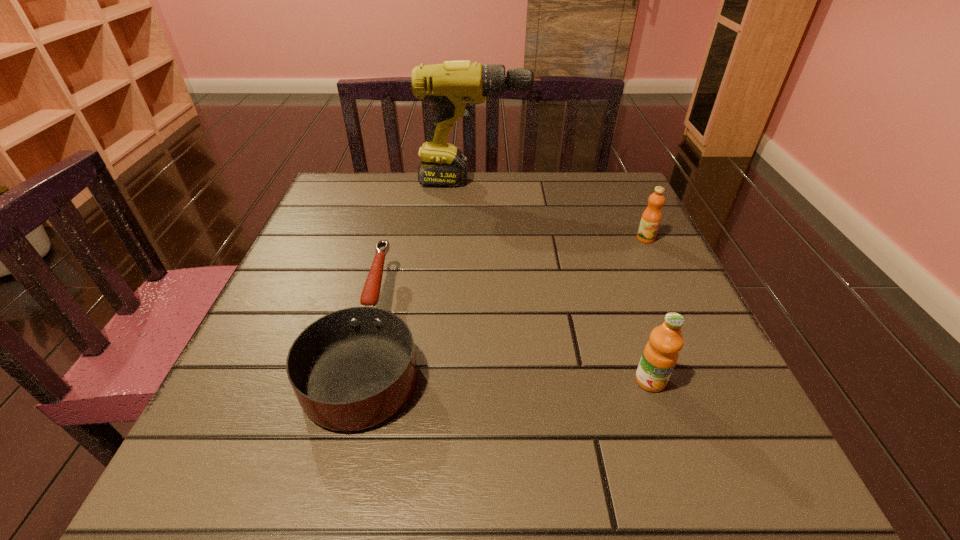
This screenshot has height=540, width=960. I want to click on vacant point located between the right orange juice and the second object from right to left, so click(x=648, y=309).

Locate an element on the screen. object that is the closest to the shortest object is located at coordinates (454, 86).

The height and width of the screenshot is (540, 960). What are the coordinates of `object identified as the second closest to the second object from right to left` in the screenshot? It's located at click(352, 369).